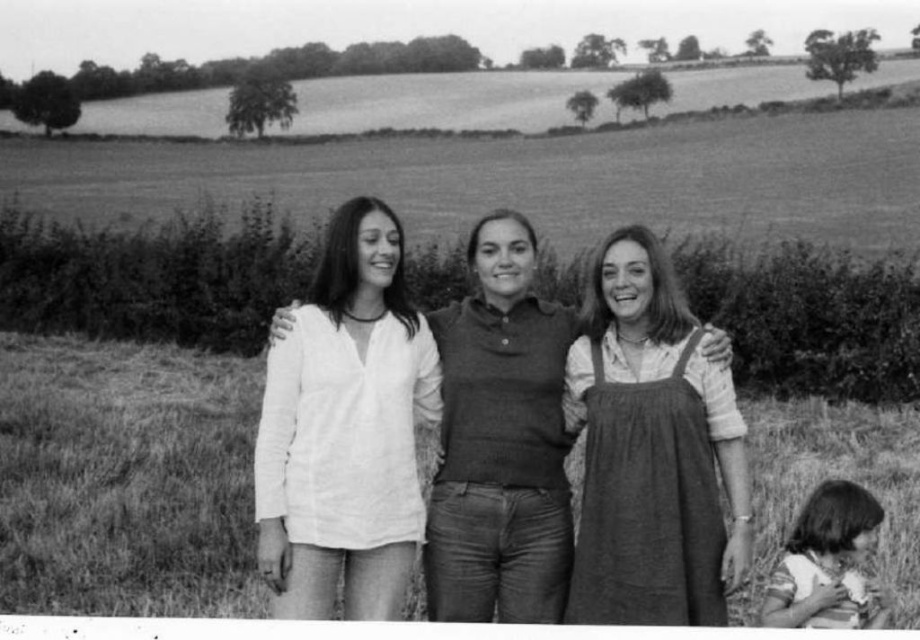
Is dungaree dress at center smaller than striped cotton shirt at lower right?

Actually, dungaree dress at center might be larger than striped cotton shirt at lower right.

Is dungaree dress at center positioned behind striped cotton shirt at lower right?

No, dungaree dress at center is in front of striped cotton shirt at lower right.

This screenshot has height=640, width=920. Find the location of `dungaree dress at center`. dungaree dress at center is located at coordinates (651, 449).

Is point (454, 452) positioned behind point (829, 516)?

Yes, it is behind point (829, 516).

Is point (473, 356) farther from camera compared to point (775, 596)?

Yes, it is behind point (775, 596).

Where is `matte white shirt at center`? The height and width of the screenshot is (640, 920). matte white shirt at center is located at coordinates (501, 442).

Is white cotton shirt at left above dungaree dress at center?

Indeed, white cotton shirt at left is positioned over dungaree dress at center.

Which is above, white cotton shirt at left or dungaree dress at center?

white cotton shirt at left is above.

Between point (315, 396) and point (613, 541), which one is positioned behind?

The point (315, 396) is more distant.

Locate an element on the screen. white cotton shirt at left is located at coordinates (345, 429).